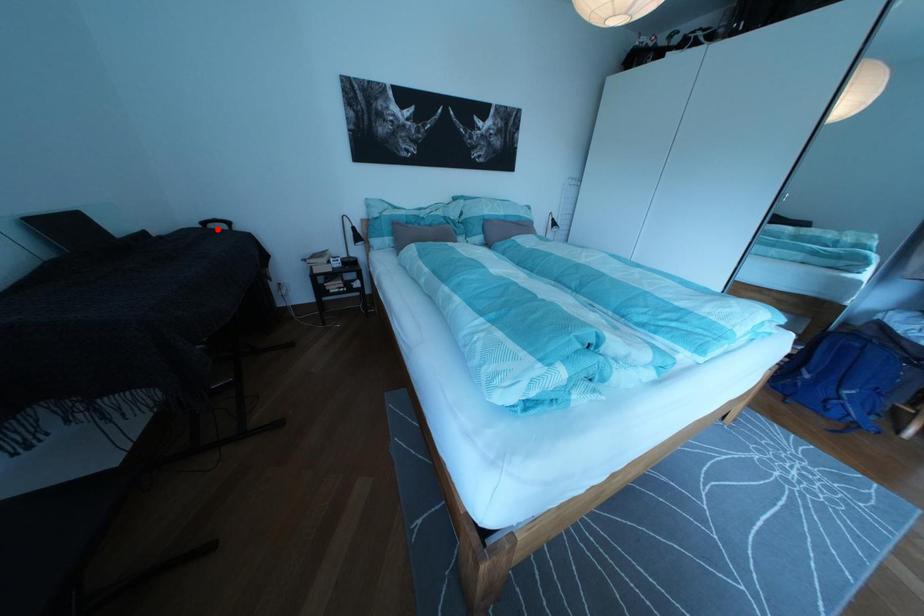
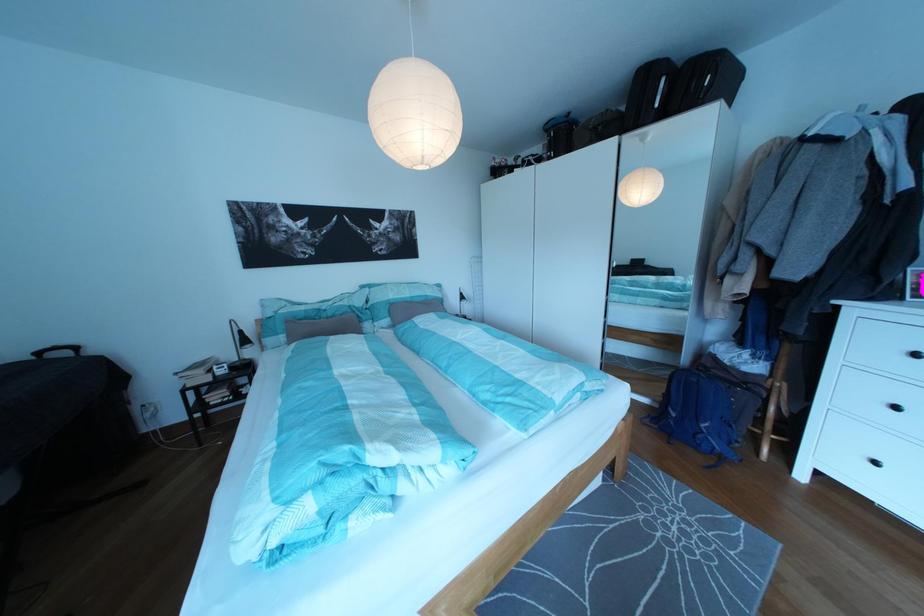
In the second image, find the point that corresponds to the highlighted location in the first image.

(53, 360)